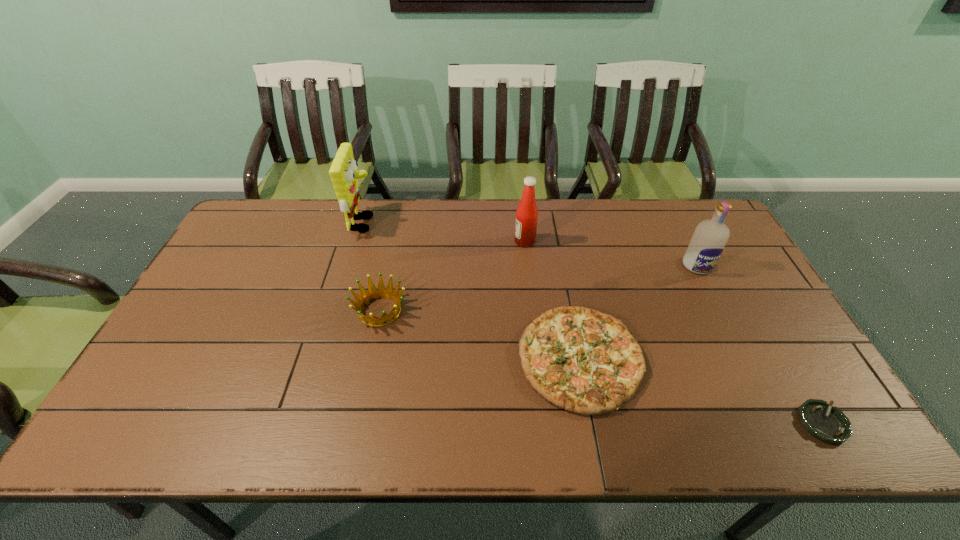
I want to click on vacant area between the pizza and the sponge, so click(x=472, y=291).

Where is `free space between the vodka and the crown`? This screenshot has height=540, width=960. free space between the vodka and the crown is located at coordinates (539, 288).

The image size is (960, 540). In order to click on free spot between the sponge and the pizza in this screenshot , I will do `click(472, 291)`.

What are the coordinates of `vacant point located between the sponge and the condiment` in the screenshot? It's located at (444, 233).

Where is `empty space between the sponge and the second shortest object`? empty space between the sponge and the second shortest object is located at coordinates (472, 291).

Point out which object is positioned as the second nearest to the sponge. Please provide its 2D coordinates. Your answer should be formatted as a tuple, i.e. [(x, y)], where the tuple contains the x and y coordinates of a point satisfying the conditions above.

[(527, 213)]

Where is `object that is the third nearest to the sponge`? This screenshot has width=960, height=540. object that is the third nearest to the sponge is located at coordinates (587, 362).

What are the coordinates of `free space that satisfies the following two spatial constraints: 1. on the front-facing side of the condiment; 2. on the right side of the pizza` in the screenshot? It's located at (538, 359).

The height and width of the screenshot is (540, 960). I want to click on free space that satisfies the following two spatial constraints: 1. on the label of the ashtray; 2. on the right side of the vodka, so tap(777, 423).

This screenshot has width=960, height=540. Identify the location of free region that satisfies the following two spatial constraints: 1. on the label of the fourth nearest object; 2. on the right side of the rightmost object. [x=777, y=423].